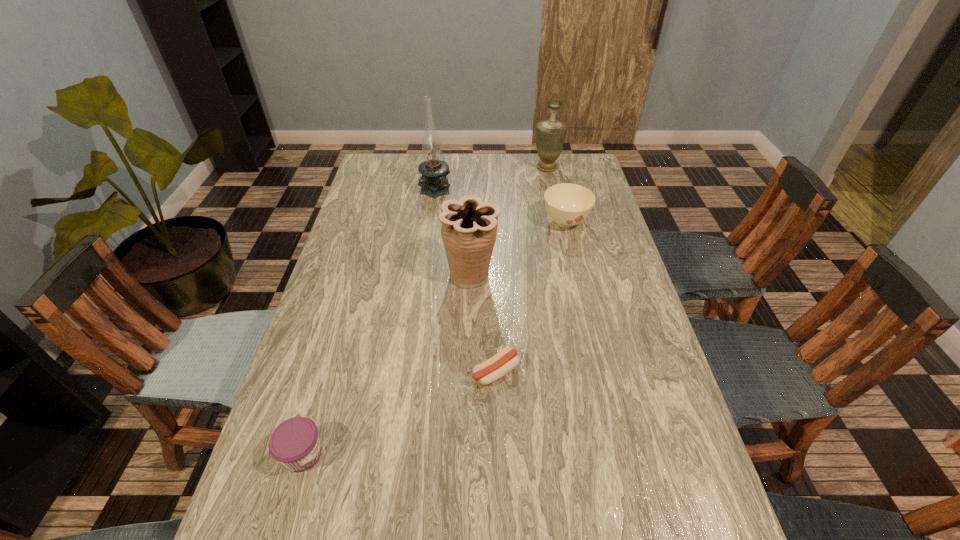
Where is `object at the left edge`? This screenshot has width=960, height=540. object at the left edge is located at coordinates (295, 443).

Where is `urn that is at the right edge`? The image size is (960, 540). urn that is at the right edge is located at coordinates (550, 134).

Find the location of a particular element. This screenshot has width=960, height=540. sugar bowl that is at the right edge is located at coordinates (567, 204).

Where is `object positioned at the far right corner`? This screenshot has width=960, height=540. object positioned at the far right corner is located at coordinates (550, 134).

Identify the location of vacant space at the far edge of the desktop. (516, 179).

You are a GUI agent. You are given a task and a screenshot of the screen. Output one action in this format:
    pyautogui.click(x=<x>, y=<y>)
    Task: Click on the free space at the left edge of the desktop
    The width and height of the screenshot is (960, 540).
    Given the screenshot: What is the action you would take?
    pyautogui.click(x=317, y=490)

Locate an element on the screen. The width and height of the screenshot is (960, 540). vacant space at the right edge is located at coordinates (586, 268).

Where is `free spot at the far left corner of the desktop`? This screenshot has width=960, height=540. free spot at the far left corner of the desktop is located at coordinates (407, 165).

Locate an element on the screen. Image resolution: width=960 pixels, height=540 pixels. free point between the third nearest object and the nearest object is located at coordinates coord(387,364).

Identify the location of free point between the third nearest object and the jam. (387, 364).